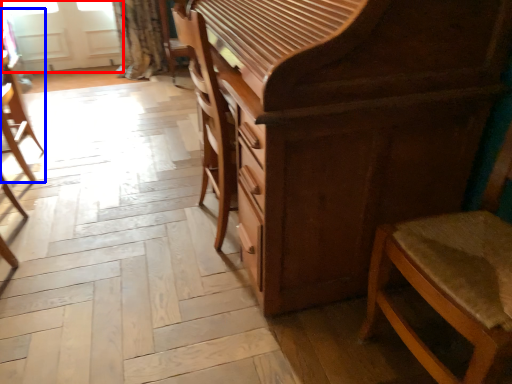
Question: Among these objects, which one is farthest to the camera, screen door (highlighted by a red box) or chair (highlighted by a blue box)?

Choices:
 (A) screen door
 (B) chair

Answer: (A)